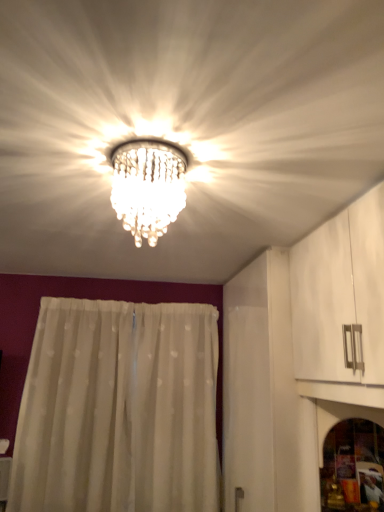
Question: Considering the relative sizes of clear crystal chandelier at center and white sheer curtain at center in the image provided, is clear crystal chandelier at center thinner than white sheer curtain at center?

Choices:
 (A) yes
 (B) no

Answer: (B)

Question: Does clear crystal chandelier at center lie behind white sheer curtain at center?

Choices:
 (A) yes
 (B) no

Answer: (B)

Question: Is clear crystal chandelier at center bigger than white sheer curtain at center?

Choices:
 (A) yes
 (B) no

Answer: (B)

Question: Could you tell me if clear crystal chandelier at center is facing white sheer curtain at center?

Choices:
 (A) no
 (B) yes

Answer: (A)

Question: Considering the relative positions of clear crystal chandelier at center and white sheer curtain at center in the image provided, is clear crystal chandelier at center to the right of white sheer curtain at center from the viewer's perspective?

Choices:
 (A) no
 (B) yes

Answer: (B)

Question: Is white sheer curtain at center wider or thinner than clear crystal chandelier at center?

Choices:
 (A) wide
 (B) thin

Answer: (B)

Question: Considering the positions of point click(x=109, y=466) and point click(x=170, y=142), is point click(x=109, y=466) closer or farther from the camera than point click(x=170, y=142)?

Choices:
 (A) farther
 (B) closer

Answer: (A)

Question: From a real-world perspective, is white sheer curtain at center positioned above or below clear crystal chandelier at center?

Choices:
 (A) below
 (B) above

Answer: (A)

Question: Considering the positions of white sheer curtain at center and clear crystal chandelier at center in the image, is white sheer curtain at center bigger or smaller than clear crystal chandelier at center?

Choices:
 (A) small
 (B) big

Answer: (B)

Question: From the image's perspective, relative to transparent glass screen door at lower right, is white sheer curtain at center above or below?

Choices:
 (A) above
 (B) below

Answer: (B)

Question: Is white sheer curtain at center in front of or behind transparent glass screen door at lower right in the image?

Choices:
 (A) behind
 (B) front

Answer: (A)

Question: From a real-world perspective, relative to transparent glass screen door at lower right, is white sheer curtain at center vertically above or below?

Choices:
 (A) below
 (B) above

Answer: (B)

Question: Is point (167, 481) positioned closer to the camera than point (357, 416)?

Choices:
 (A) closer
 (B) farther

Answer: (B)

Question: From a real-world perspective, is transparent glass screen door at lower right above or below white sheer curtain at center?

Choices:
 (A) above
 (B) below

Answer: (B)

Question: From the image's perspective, is transparent glass screen door at lower right positioned above or below white sheer curtain at center?

Choices:
 (A) above
 (B) below

Answer: (A)